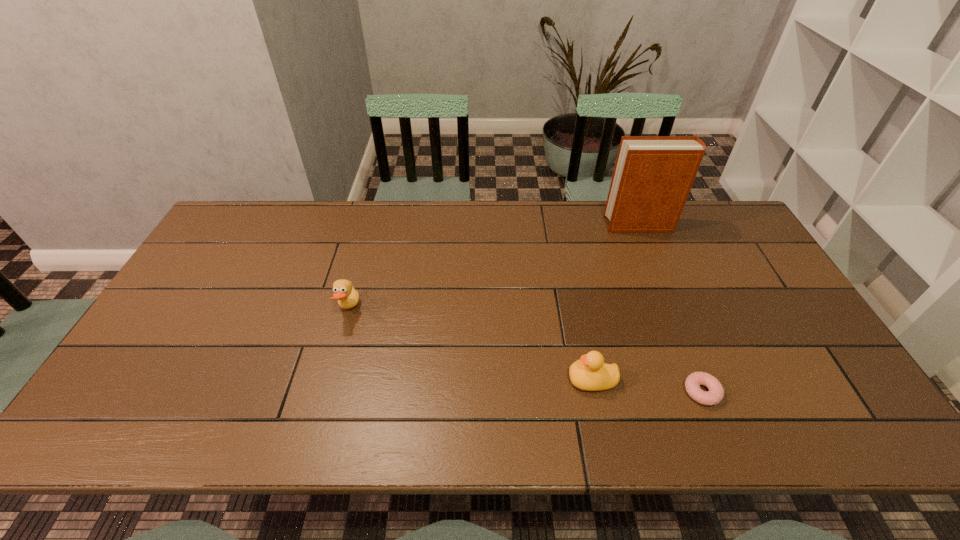
Find the location of `vacant point at the right edge`. vacant point at the right edge is located at coordinates (747, 322).

In the image, there is a desktop. In order to click on free space at the far left corner in this screenshot , I will do `click(220, 227)`.

What are the coordinates of `vacant area at the far right corner` in the screenshot? It's located at (727, 211).

Where is `vacant point located between the second object from left to right and the farther duck`? The height and width of the screenshot is (540, 960). vacant point located between the second object from left to right and the farther duck is located at coordinates (470, 345).

Where is `free spot between the farthest object and the farther duck`? free spot between the farthest object and the farther duck is located at coordinates (494, 267).

Find the location of a particular element. This screenshot has height=540, width=960. vacant region between the left duck and the doughnut is located at coordinates (525, 350).

At what (x,y) coordinates should I click in order to perform the action: click on free space that is in between the nearer duck and the tallest object. Please return your answer as a coordinate pair (x, y). This screenshot has width=960, height=540. Looking at the image, I should click on (615, 302).

Locate an element on the screen. free space between the shortest object and the hardback book is located at coordinates (671, 308).

Where is `free space between the second object from left to right and the doughnut`? This screenshot has height=540, width=960. free space between the second object from left to right and the doughnut is located at coordinates (647, 386).

You are a GUI agent. You are given a task and a screenshot of the screen. Output one action in this format:
    pyautogui.click(x=<x>, y=<y>)
    Task: Click on the free spot between the doughnut and the hardback book
    The height and width of the screenshot is (540, 960).
    Given the screenshot: What is the action you would take?
    pyautogui.click(x=671, y=308)